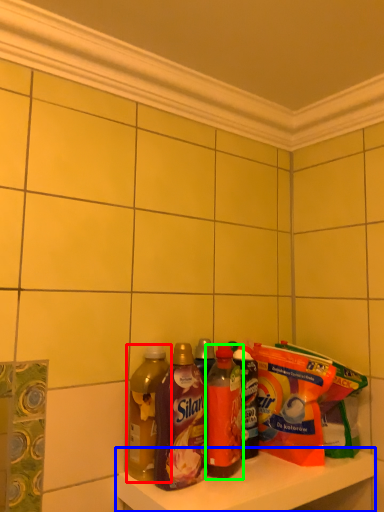
Question: Considering the real-world distances, which object is closest to bottle (highlighted by a red box)? shelf (highlighted by a blue box) or bottle (highlighted by a green box).

Choices:
 (A) shelf
 (B) bottle

Answer: (B)